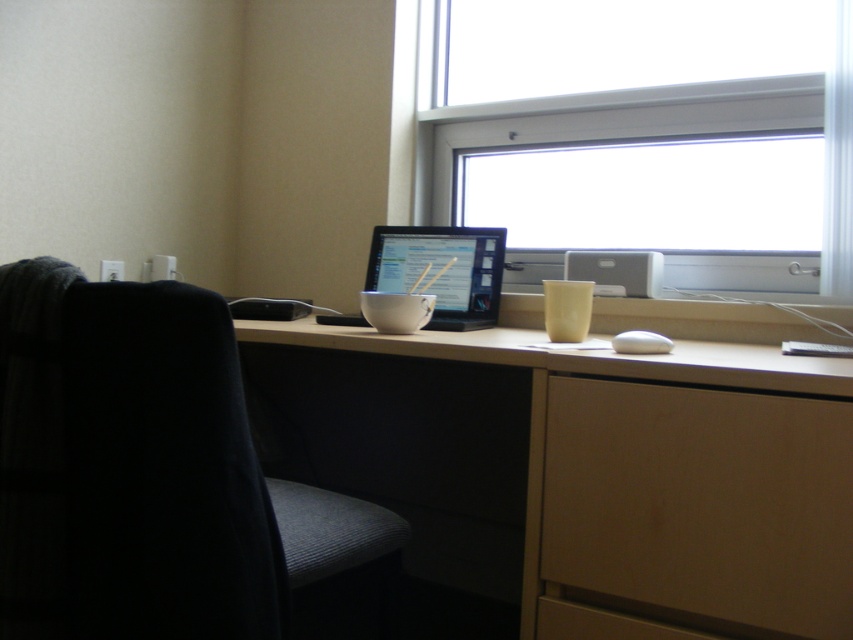
Question: From the image, what is the correct spatial relationship of wooden drawer at lower right in relation to matte black monitor at center?

Choices:
 (A) right
 (B) left

Answer: (A)

Question: Is light wood computer desk at center further to the viewer compared to matte black monitor at center?

Choices:
 (A) no
 (B) yes

Answer: (A)

Question: Which object is positioned farthest from the wooden drawer at lower right?

Choices:
 (A) matte black monitor at center
 (B) light wood computer desk at center

Answer: (A)

Question: Is transparent glass window at upper center positioned behind matte black monitor at center?

Choices:
 (A) yes
 (B) no

Answer: (B)

Question: Which object appears farthest from the camera in this image?

Choices:
 (A) matte black monitor at center
 (B) light wood computer desk at center
 (C) wooden drawer at lower right
 (D) transparent glass window at upper center

Answer: (A)

Question: Estimate the real-world distances between objects in this image. Which object is closer to the light wood computer desk at center?

Choices:
 (A) transparent glass window at upper center
 (B) matte black monitor at center

Answer: (B)